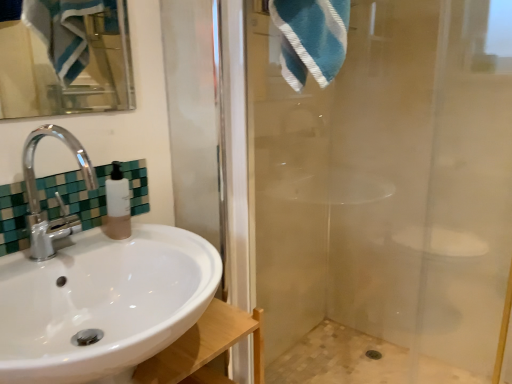
The image size is (512, 384). I want to click on empty space that is ontop of beige mosaic tile bath at lower right (from a real-world perspective), so click(x=366, y=362).